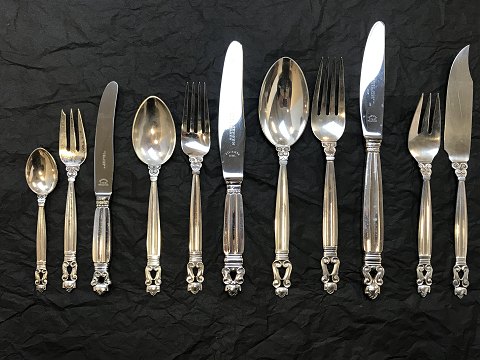
Identify the location of other utensils not forks. The height and width of the screenshot is (360, 480). (44, 174), (158, 128), (283, 97), (104, 154), (224, 105), (370, 88), (461, 110).